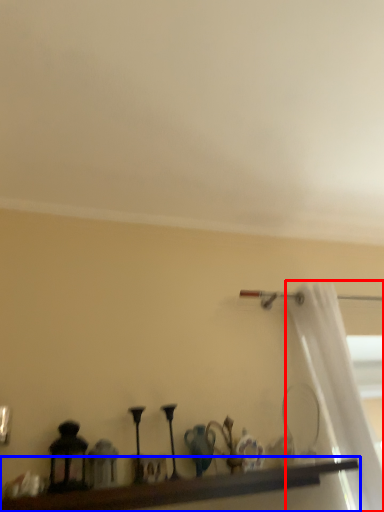
Question: Which object appears farthest to the camera in this image, curtain (highlighted by a red box) or shelf (highlighted by a blue box)?

Choices:
 (A) curtain
 (B) shelf

Answer: (A)